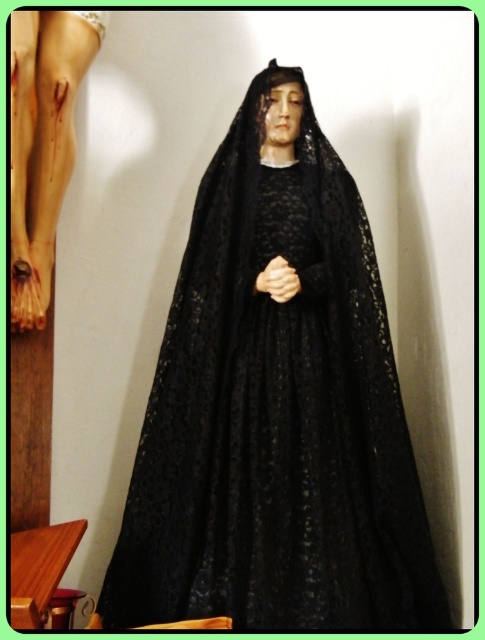
You are standing in front of the statue and want to place a small flower bouquet at one of the two points marked in the image. The first point is at coordinate point (x=290, y=529) and the second is at point (x=82, y=13). Which point is closer to you so that the bouquet will be more visible to visitors approaching from the front?

Point (x=290, y=529) is closer to you than point (x=82, y=13), so placing the bouquet there will make it more visible to visitors approaching from the front.

You are an art curator planning to move the black lace statue at center and the matte black statue at upper center to a new exhibition space. If you want to maintain the original spatial relationship between them, which statue should be placed behind the other?

The matte black statue at upper center should be placed behind the black lace statue at center to maintain their original spatial relationship as described.

You are an art curator planning to move the black lace statue at center and the matte black statue at upper center to a new exhibition space. The new space has a height restriction of 2 meters. Given their positions in the current image, can both statues be moved without any modifications?

The black lace statue at center is located below the matte black statue at upper center. Since the matte black statue at upper center is positioned higher up, it might exceed the 2 meter height restriction in the new exhibition space. Therefore, modifications may be required for the matte black statue at upper center to ensure it fits within the height limit.